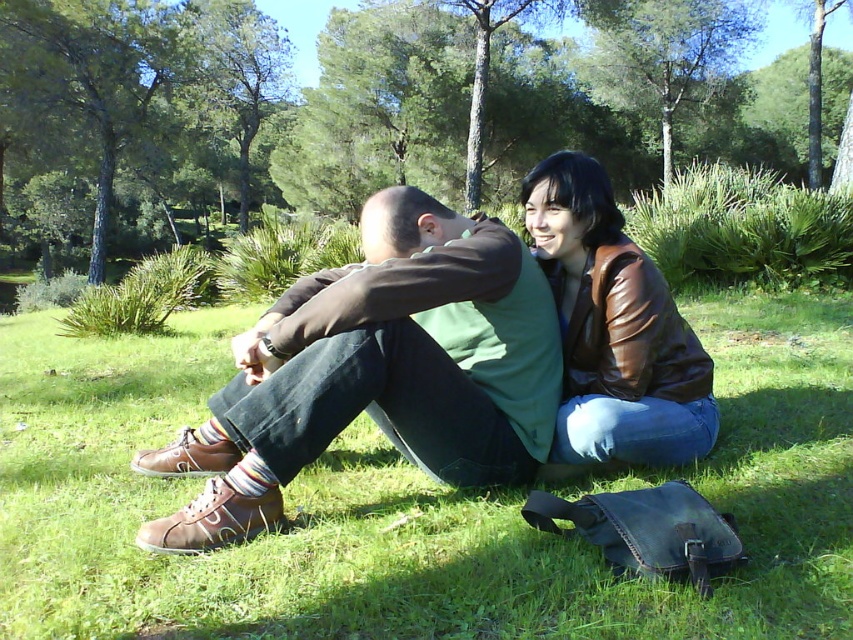
Question: Which point is closer to the camera?

Choices:
 (A) (183, 612)
 (B) (573, 339)

Answer: (A)

Question: Does green leafy tree at center appear on the right side of green leafy tree at upper center?

Choices:
 (A) no
 (B) yes

Answer: (A)

Question: Does green grass at center appear under brown leather shoes at lower left?

Choices:
 (A) yes
 (B) no

Answer: (B)

Question: Which object appears farthest from the camera in this image?

Choices:
 (A) green leafy tree at upper left
 (B) green leafy tree at upper center
 (C) green leafy tree at center
 (D) brown leather shoes at lower left

Answer: (B)

Question: Is green leafy tree at center closer to camera compared to brown leather jacket at upper right?

Choices:
 (A) yes
 (B) no

Answer: (B)

Question: Among these points, which one is farthest from the camera?

Choices:
 (A) (689, 56)
 (B) (155, 460)

Answer: (A)